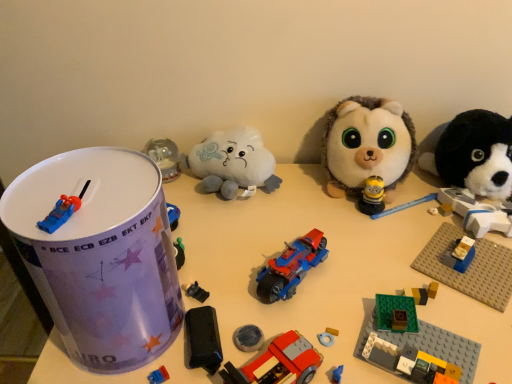
Where is `free location to the right of shiny plastic motorcycle at center, which is the sixth toy in left-to-right order`? This screenshot has width=512, height=384. free location to the right of shiny plastic motorcycle at center, which is the sixth toy in left-to-right order is located at coordinates (402, 257).